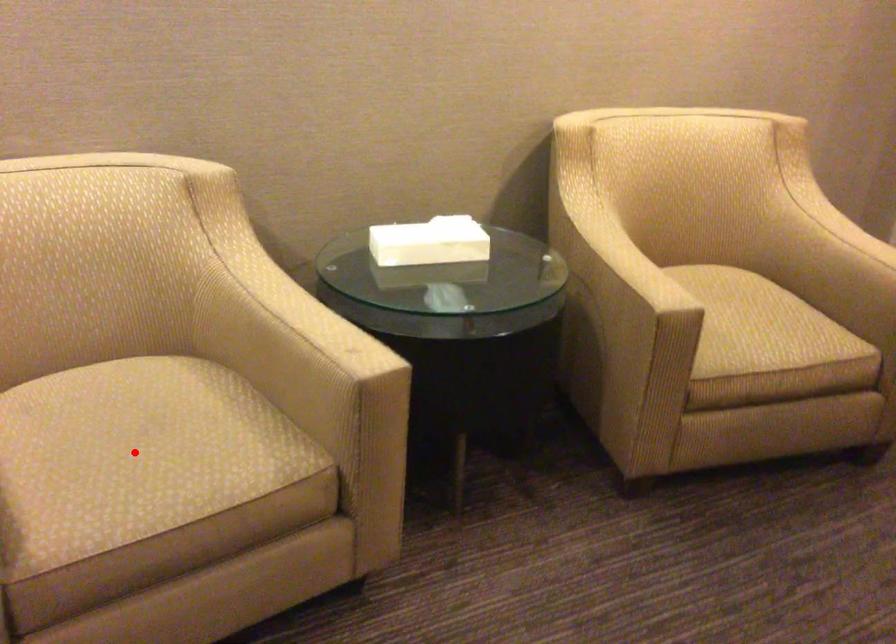
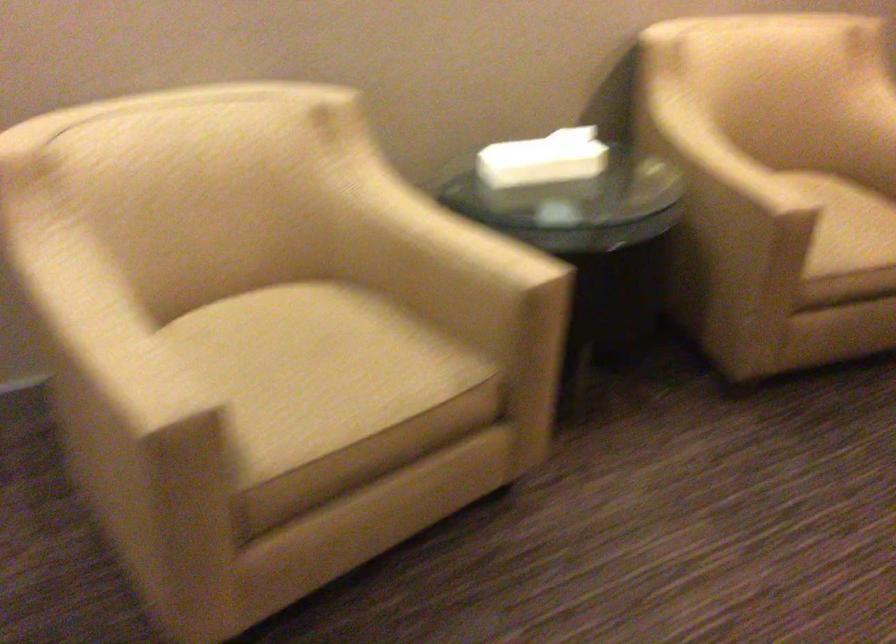
Find the pixel in the second image that matches the highlighted location in the first image.

(316, 370)